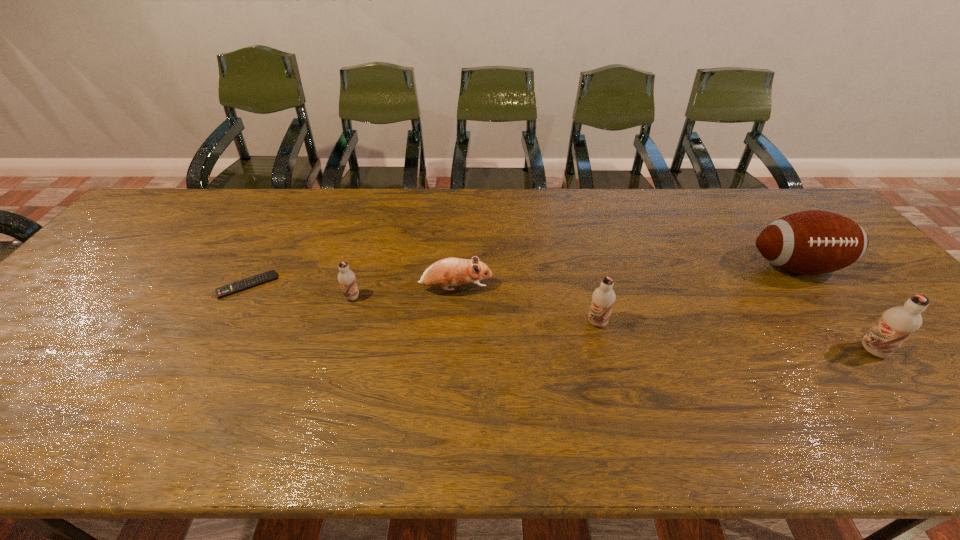
The width and height of the screenshot is (960, 540). In order to click on vacant area in the image that satisfies the following two spatial constraints: 1. on the laces of the football; 2. at the face of the second shortest object in this screenshot , I will do `click(813, 289)`.

Find the location of a particular element. free space that satisfies the following two spatial constraints: 1. on the laces of the football; 2. at the face of the second shortest object is located at coordinates [813, 289].

Where is `vacant region that satisfies the following two spatial constraints: 1. on the front side of the tallest chocolate milk; 2. on the right side of the farthest chocolate milk`? The width and height of the screenshot is (960, 540). vacant region that satisfies the following two spatial constraints: 1. on the front side of the tallest chocolate milk; 2. on the right side of the farthest chocolate milk is located at coordinates (336, 350).

The width and height of the screenshot is (960, 540). What are the coordinates of `free spot that satisfies the following two spatial constraints: 1. at the face of the rightmost chocolate milk; 2. on the right side of the fifth tallest object` in the screenshot? It's located at (452, 350).